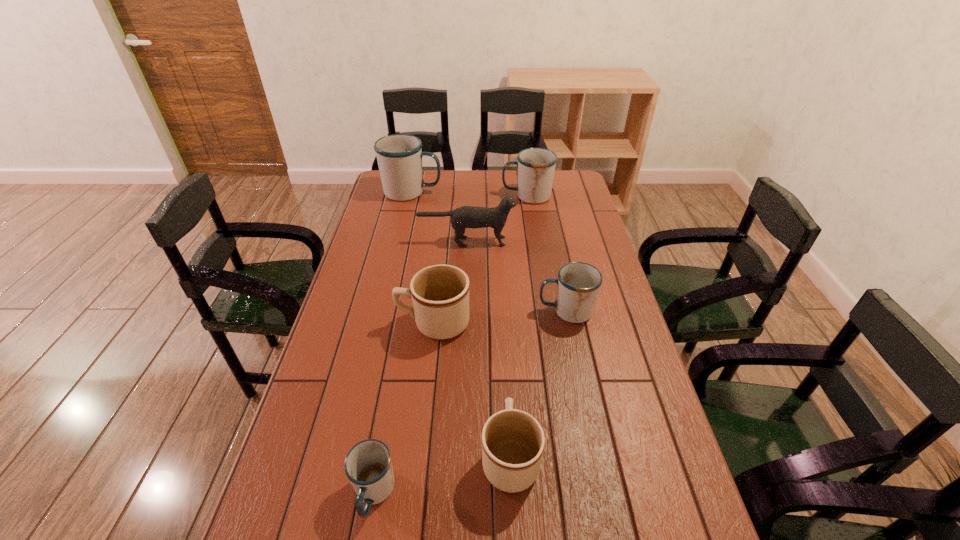
The image size is (960, 540). Identify the location of vacant space at the right edge of the desktop. (648, 502).

This screenshot has width=960, height=540. I want to click on free space at the far right corner of the desktop, so click(x=567, y=188).

At what (x,y) coordinates should I click in order to perform the action: click on vacant point located between the third smallest white mug and the biggest white mug. Please return your answer as a coordinate pair (x, y). The height and width of the screenshot is (540, 960). Looking at the image, I should click on (x=469, y=194).

Identify the location of free space between the biggest white mug and the farther brown mug. This screenshot has width=960, height=540. [423, 258].

Find the location of a particular element. The height and width of the screenshot is (540, 960). free space between the second biggest white mug and the third biggest white mug is located at coordinates (546, 254).

The image size is (960, 540). What are the coordinates of `vacant space in between the shortest mug and the fifth nearest object` in the screenshot? It's located at (420, 368).

Identify which object is the sixth nearest to the right brown mug. Please provide its 2D coordinates. Your answer should be formatted as a tuple, i.e. [(x, y)], where the tuple contains the x and y coordinates of a point satisfying the conditions above.

[(399, 156)]

Select which object appears as the fourth closest to the third smallest white mug. Please provide its 2D coordinates. Your answer should be formatted as a tuple, i.e. [(x, y)], where the tuple contains the x and y coordinates of a point satisfying the conditions above.

[(440, 293)]

Choose which mug is the fifth nearest neighbor to the left brown mug. Please provide its 2D coordinates. Your answer should be formatted as a tuple, i.e. [(x, y)], where the tuple contains the x and y coordinates of a point satisfying the conditions above.

[(399, 156)]

Identify which mug is the third closest to the nearer brown mug. Please provide its 2D coordinates. Your answer should be formatted as a tuple, i.e. [(x, y)], where the tuple contains the x and y coordinates of a point satisfying the conditions above.

[(578, 283)]